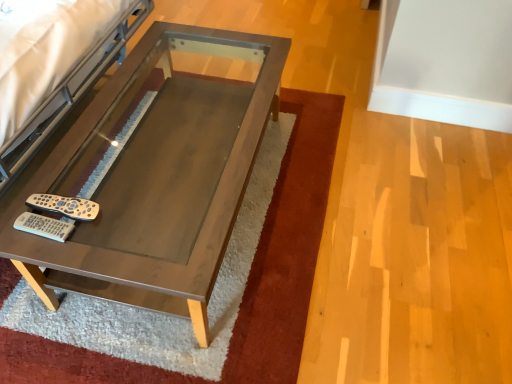
Identify the location of vacant space in front of silver metallic remote at lower left. (51, 246).